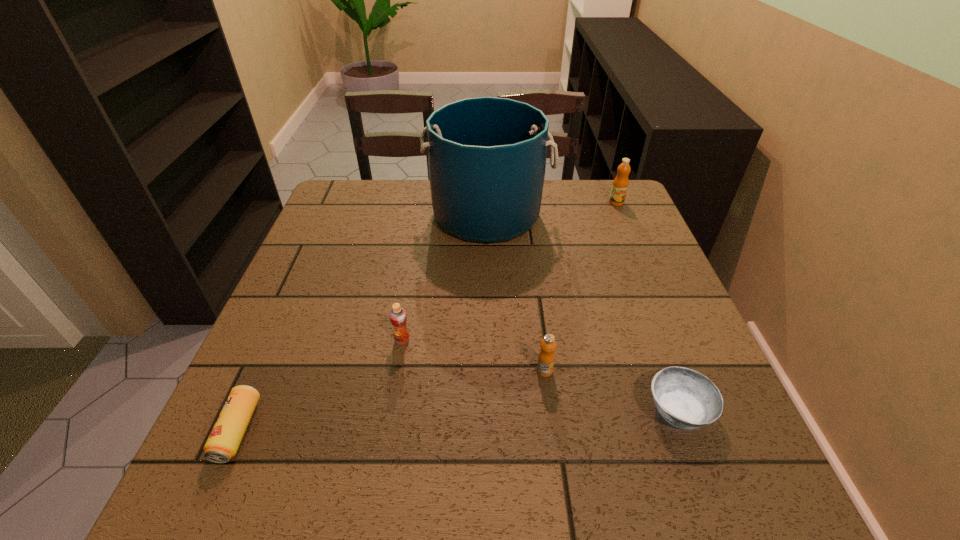
Choose which orange juice is the nearest neighbor to the second orange juice from right to left. Please provide its 2D coordinates. Your answer should be formatted as a tuple, i.e. [(x, y)], where the tuple contains the x and y coordinates of a point satisfying the conditions above.

[(398, 317)]